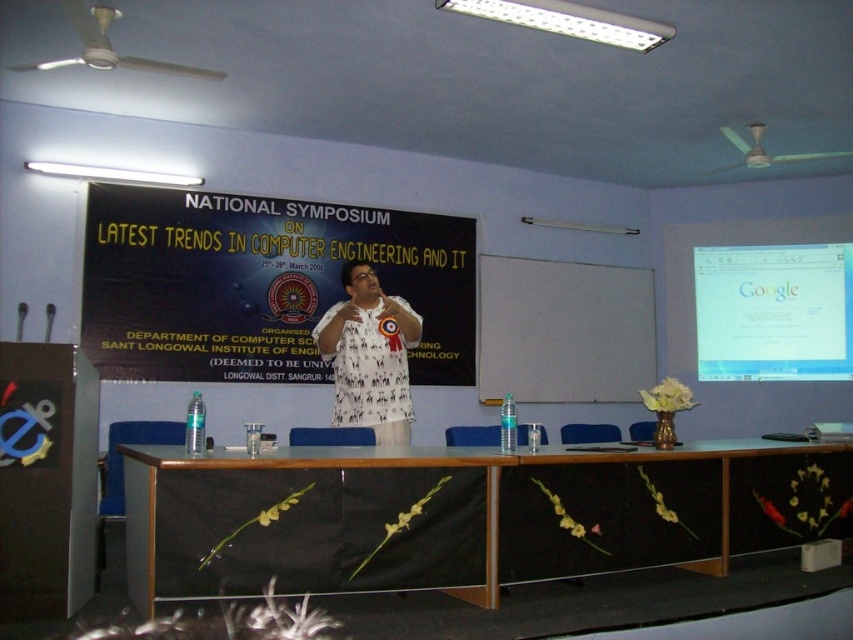
Question: Which object appears closest to the camera in this image?

Choices:
 (A) white glossy projector screen at upper right
 (B) white printed shirt at center

Answer: (B)

Question: Which point is closer to the camera?

Choices:
 (A) (386, 352)
 (B) (276, 378)
 (C) (699, 316)

Answer: (A)

Question: Can you confirm if black matte banner at center is smaller than white printed shirt at center?

Choices:
 (A) no
 (B) yes

Answer: (A)

Question: Is the position of black wood table at center less distant than that of black matte banner at center?

Choices:
 (A) no
 (B) yes

Answer: (B)

Question: Which object appears farthest from the camera in this image?

Choices:
 (A) white glossy projector screen at upper right
 (B) white printed shirt at center
 (C) black matte banner at center

Answer: (A)

Question: Does black matte banner at center appear on the right side of white printed shirt at center?

Choices:
 (A) yes
 (B) no

Answer: (B)